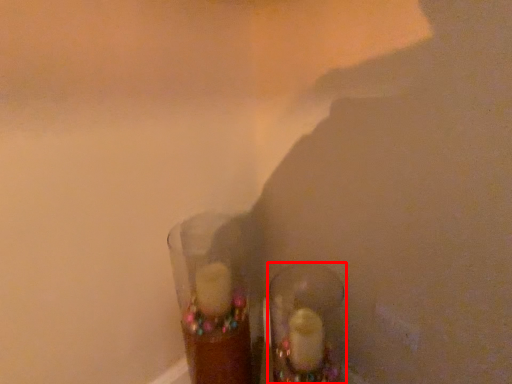
Question: From the image, what is the correct spatial relationship of footwear (annotated by the red box) in relation to shot glass?

Choices:
 (A) right
 (B) left

Answer: (A)